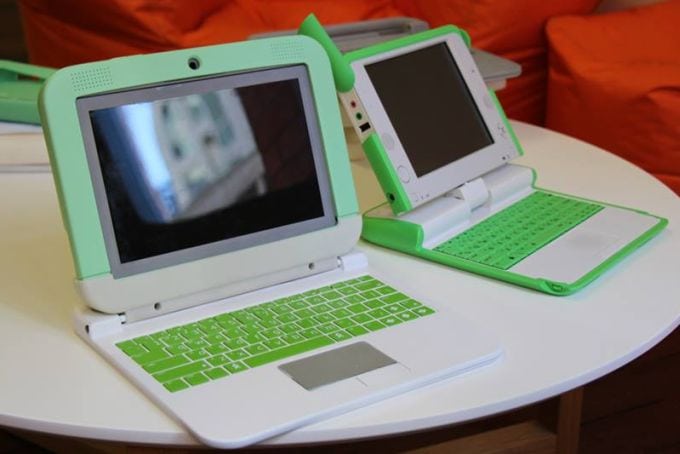
The height and width of the screenshot is (454, 680). Find the location of `edge of table top`. edge of table top is located at coordinates (560, 391).